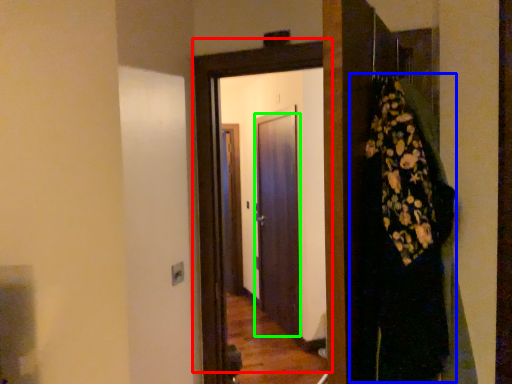
Question: Considering the real-world distances, which object is farthest from door (highlighted by a red box)? dress (highlighted by a blue box) or door (highlighted by a green box)?

Choices:
 (A) dress
 (B) door

Answer: (B)